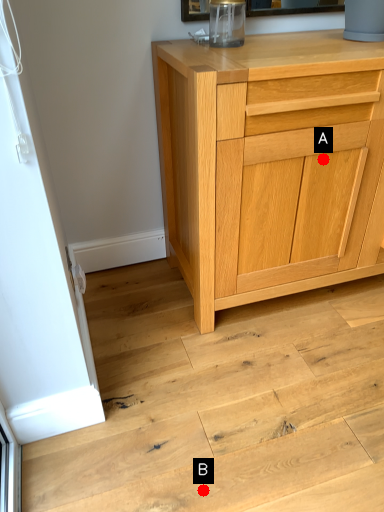
Question: Two points are circled on the image, labeled by A and B beside each circle. Which of the following is the closest to the observer?

Choices:
 (A) A is closer
 (B) B is closer

Answer: (B)